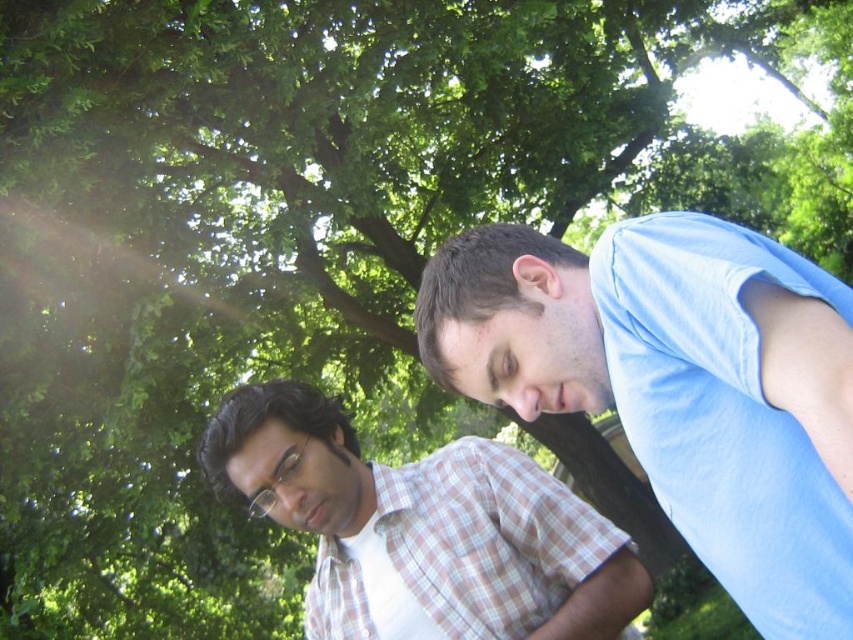
You are standing in a park and want to reach a specific point marked as point (786, 605). If your arm is 36 inches long, can you reach that point without moving your feet?

The distance of point (786, 605) from viewer is 35.94 inches, so yes, you can reach that point with your arm since it is slightly shorter than your arm length.